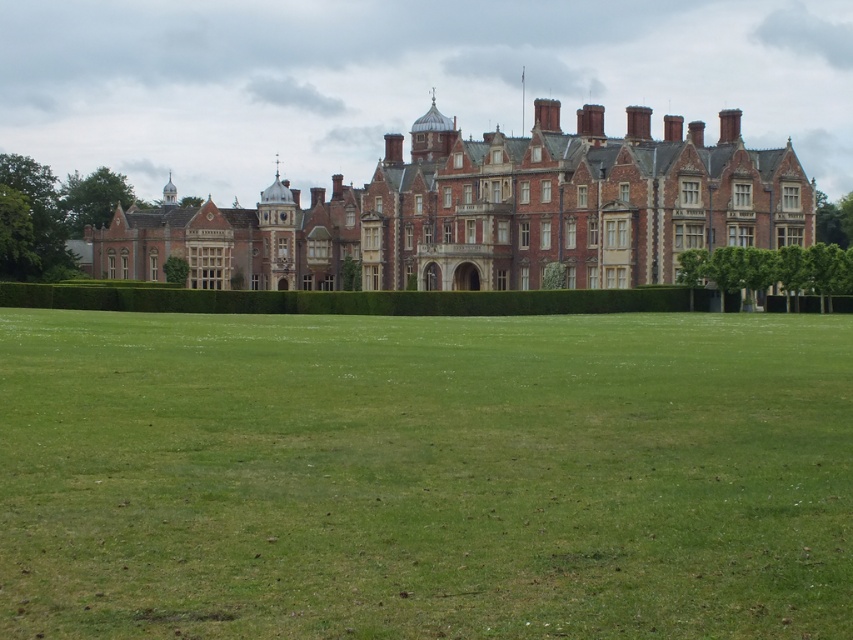
Question: Considering the relative positions of green grass at lower center and brick stone mansion at center in the image provided, where is green grass at lower center located with respect to brick stone mansion at center?

Choices:
 (A) right
 (B) left

Answer: (B)

Question: Is the position of green grass at lower center more distant than that of brick stone mansion at center?

Choices:
 (A) yes
 (B) no

Answer: (B)

Question: Which point is farther to the camera?

Choices:
 (A) brick stone mansion at center
 (B) green grass at lower center

Answer: (A)

Question: Observing the image, what is the correct spatial positioning of green grass at lower center in reference to brick stone mansion at center?

Choices:
 (A) below
 (B) above

Answer: (A)

Question: Which point is farther to the camera?

Choices:
 (A) (219, 512)
 (B) (585, 193)

Answer: (B)

Question: Which object appears farthest from the camera in this image?

Choices:
 (A) brick stone mansion at center
 (B) green grass at lower center

Answer: (A)